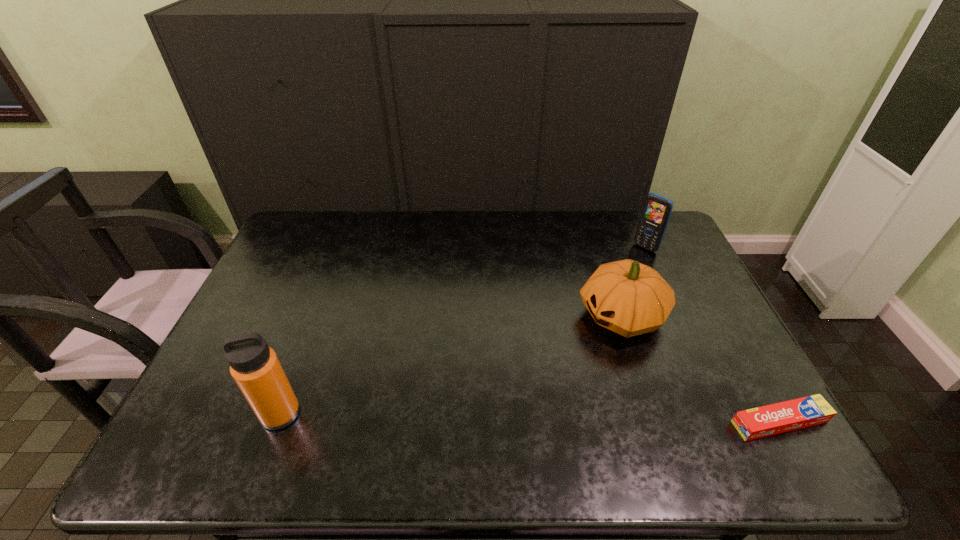
Where is `vacant area that lies between the farthest object and the tallest object`? The height and width of the screenshot is (540, 960). vacant area that lies between the farthest object and the tallest object is located at coordinates (463, 331).

Locate an element on the screen. This screenshot has width=960, height=540. empty space between the shortest object and the cellular telephone is located at coordinates (712, 335).

Locate an element on the screen. vacant area between the thermos bottle and the farthest object is located at coordinates (463, 331).

Locate which object ranks second in proximity to the third nearest object. Please provide its 2D coordinates. Your answer should be formatted as a tuple, i.e. [(x, y)], where the tuple contains the x and y coordinates of a point satisfying the conditions above.

[(768, 420)]

Locate an element on the screen. object that ranks as the second closest to the thermos bottle is located at coordinates (768, 420).

Identify the location of vacant space that satisfies the following two spatial constraints: 1. on the front side of the shortest object; 2. on the left side of the gourd. The image size is (960, 540). (656, 422).

The height and width of the screenshot is (540, 960). What are the coordinates of `vacant position in the image that satisfies the following two spatial constraints: 1. on the front side of the toothpaste; 2. on the left side of the tallest object` in the screenshot? It's located at (277, 422).